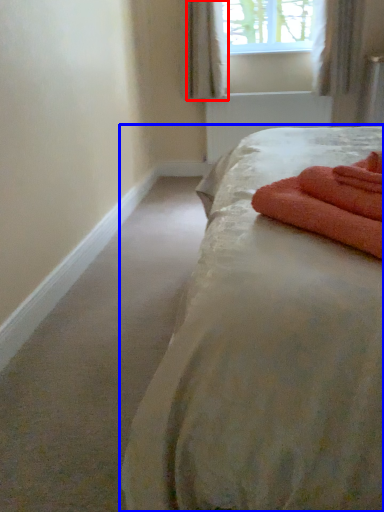
Question: Which object is further to the camera taking this photo, curtain (highlighted by a red box) or bed (highlighted by a blue box)?

Choices:
 (A) curtain
 (B) bed

Answer: (A)